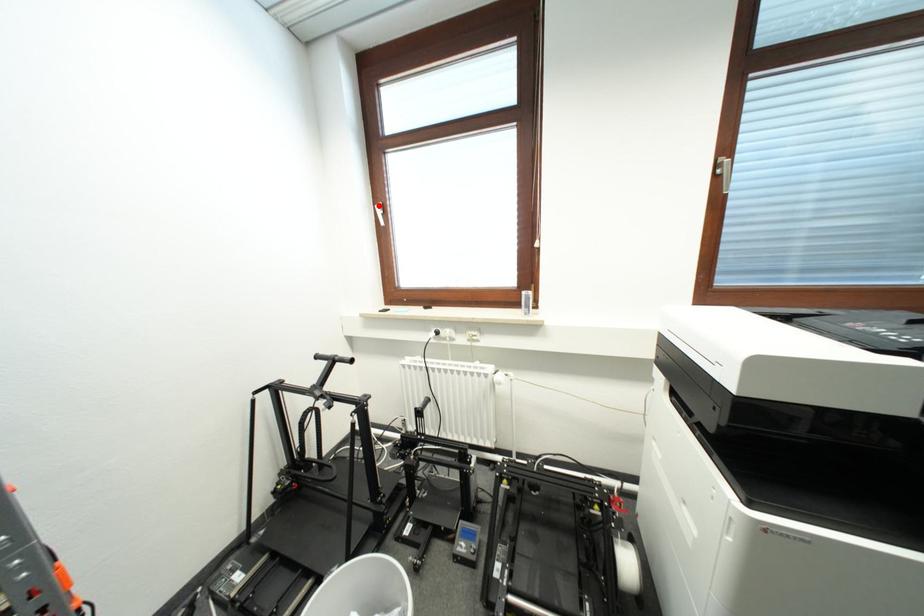
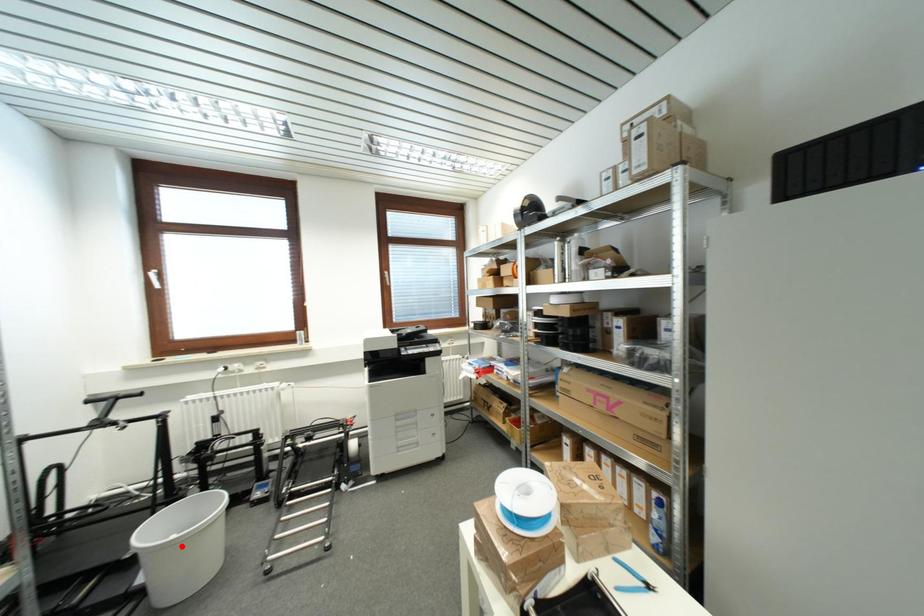
I am providing you with two images of the same scene from different viewpoints. A red point is marked on the first image and another point is marked on the second image. Is the red point in image1 aligned with the point shown in image2?

No